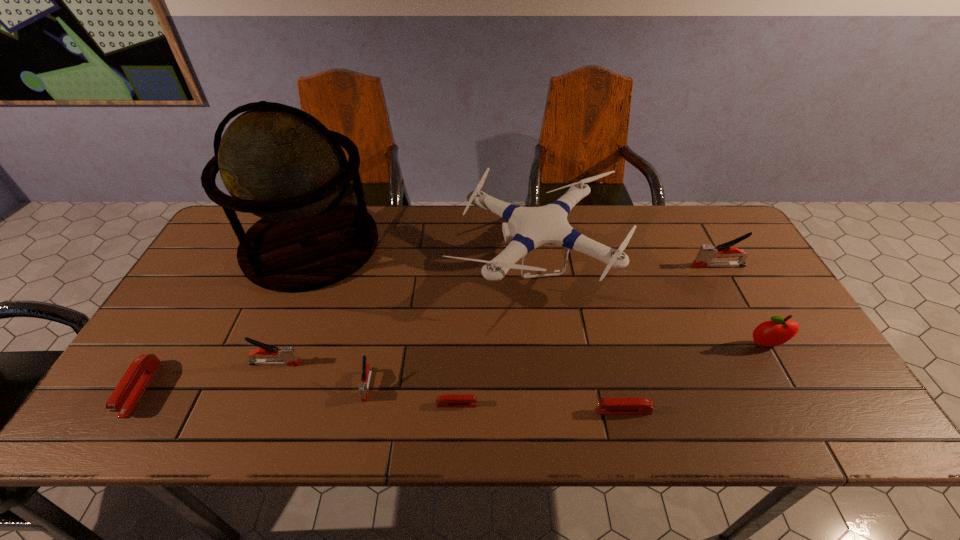
At what (x,y) coordinates should I click in order to perform the action: click on object that is the third closest to the eighth shortest object. Please return your answer as a coordinate pair (x, y). The height and width of the screenshot is (540, 960). Looking at the image, I should click on (449, 400).

Point out which object is positioned as the third nearest to the second tallest stapler. Please provide its 2D coordinates. Your answer should be formatted as a tuple, i.e. [(x, y)], where the tuple contains the x and y coordinates of a point satisfying the conditions above.

[(280, 163)]

Identify the location of stapler that is the third closest to the blue drone. (449, 400).

Identify which stapler is the fifth nearest to the shortest stapler. Please provide its 2D coordinates. Your answer should be formatted as a tuple, i.e. [(x, y)], where the tuple contains the x and y coordinates of a point satisfying the conditions above.

[(706, 253)]

This screenshot has height=540, width=960. Find the location of `gray stapler that is the closest to the second biggest red stapler`. gray stapler that is the closest to the second biggest red stapler is located at coordinates (367, 369).

Identify the location of gray stapler identified as the closest to the second shortest stapler. This screenshot has width=960, height=540. (367, 369).

Identify which red stapler is the second closest to the apple. Please provide its 2D coordinates. Your answer should be formatted as a tuple, i.e. [(x, y)], where the tuple contains the x and y coordinates of a point satisfying the conditions above.

[(449, 400)]

The height and width of the screenshot is (540, 960). I want to click on red stapler that stands as the closest to the leftmost red stapler, so click(x=449, y=400).

I want to click on free space in the image that satisfies the following two spatial constraints: 1. on the front-facing side of the tallest object; 2. on the left side of the apple, so click(x=270, y=345).

Identify the location of free point that satisfies the following two spatial constraints: 1. on the front-facing side of the globe; 2. on the front-facing side of the biggest red stapler. (252, 389).